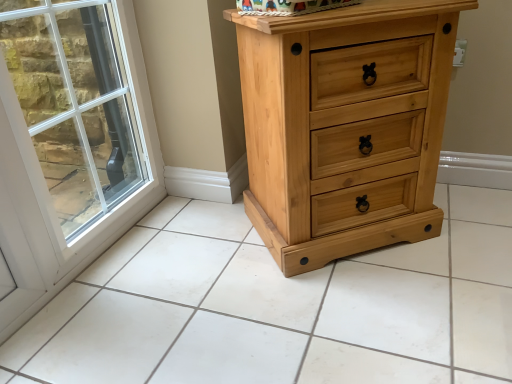
Question: Considering the relative sizes of natural wood chest of drawers at right and natural wood tile at center in the image provided, is natural wood chest of drawers at right smaller than natural wood tile at center?

Choices:
 (A) yes
 (B) no

Answer: (B)

Question: Can you confirm if natural wood chest of drawers at right is taller than natural wood tile at center?

Choices:
 (A) no
 (B) yes

Answer: (B)

Question: Is natural wood chest of drawers at right oriented towards natural wood tile at center?

Choices:
 (A) yes
 (B) no

Answer: (B)

Question: Does natural wood chest of drawers at right have a lesser width compared to natural wood tile at center?

Choices:
 (A) no
 (B) yes

Answer: (B)

Question: Does natural wood chest of drawers at right have a larger size compared to natural wood tile at center?

Choices:
 (A) yes
 (B) no

Answer: (A)

Question: Does natural wood chest of drawers at right have a greater width compared to natural wood tile at center?

Choices:
 (A) yes
 (B) no

Answer: (B)

Question: Can you see natural wood chest of drawers at right touching white glass window at left?

Choices:
 (A) no
 (B) yes

Answer: (A)

Question: Can you confirm if natural wood chest of drawers at right is thinner than white glass window at left?

Choices:
 (A) yes
 (B) no

Answer: (B)

Question: Does natural wood chest of drawers at right have a smaller size compared to white glass window at left?

Choices:
 (A) no
 (B) yes

Answer: (A)

Question: Can you confirm if natural wood chest of drawers at right is taller than white glass window at left?

Choices:
 (A) no
 (B) yes

Answer: (A)

Question: Is natural wood chest of drawers at right oriented towards white glass window at left?

Choices:
 (A) yes
 (B) no

Answer: (B)

Question: Would you say white glass window at left is part of natural wood chest of drawers at right's contents?

Choices:
 (A) yes
 (B) no

Answer: (B)

Question: From the image's perspective, is white glass window at left on natural wood chest of drawers at right?

Choices:
 (A) yes
 (B) no

Answer: (B)